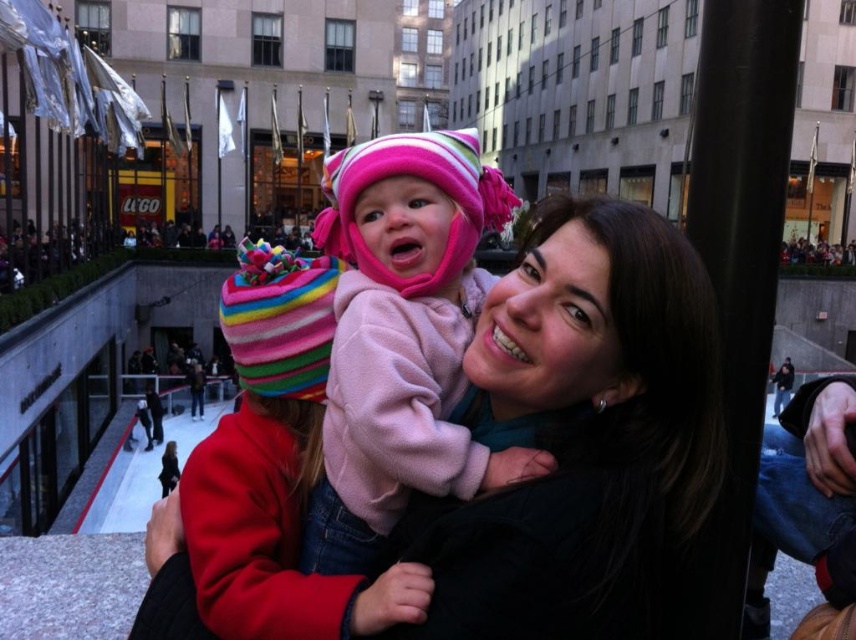
You are standing at the center of the plaza and see the point marked at coordinates (580, 436). What object is located at that point?

The point at coordinates (580, 436) is occupied by the matte black jacket at center.

You are a photographer trying to capture a candid shot of the pink fleece baby at center. Since the matte black jacket at center is blocking your view, can you estimate how much you need to adjust your camera angle to see the baby?

The matte black jacket at center is closer to the viewer than the pink fleece baby at center, so you need to adjust your camera angle downward to see the pink fleece baby at center behind the jacket.

You are a photographer trying to capture a candid shot of the pink fleece baby at center and the matte black jacket at center. Since you want to focus on the baby, where should you position your camera relative to the subjects?

The matte black jacket at center is located below the pink fleece baby at center, so you should position your camera above the subjects to ensure the baby is in focus while avoiding obstruction from the jacket.